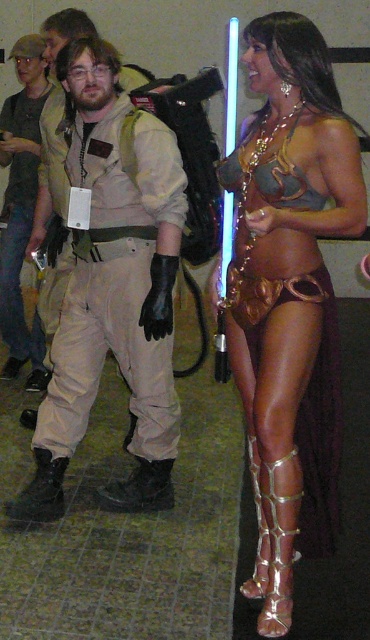
You are standing at the point with coordinates point (8, 317) and want to move towards the entrance of the convention hall. There is an obstacle at point (56, 68). Will you be able to see the entrance clearly from your current position?

Since point (56, 68) is in front of point (8, 317), the obstacle at point (56, 68) will block your view of the entrance from your current position.

You are a photographer at the event and need to frame a shot that includes both the metallic gold bikini at center and the matte khaki pants at left. Given that the camera can only capture items within a 30 cm width limit, will both items fit side by side in the frame?

The metallic gold bikini at center is wider than the matte khaki pants at left. Since the camera has a 30 cm width limit, both items can only fit if their combined widths are within this limit. However, without knowing the exact widths of each item, it is impossible to determine if they will fit together in the frame.

You are a photographer at the event and want to capture a photo of both the metallic gold bikini at center and the khaki cotton pants at center in the same frame. The camera you are using has a maximum focus range of 20 inches. Can you fit both items in the frame without moving the camera?

The metallic gold bikini at center is 22.07 inches away from the khaki cotton pants at center. Since the camera can only focus up to 20 inches, the distance between them exceeds the maximum focus range. Therefore, you cannot fit both items in the frame without moving the camera.